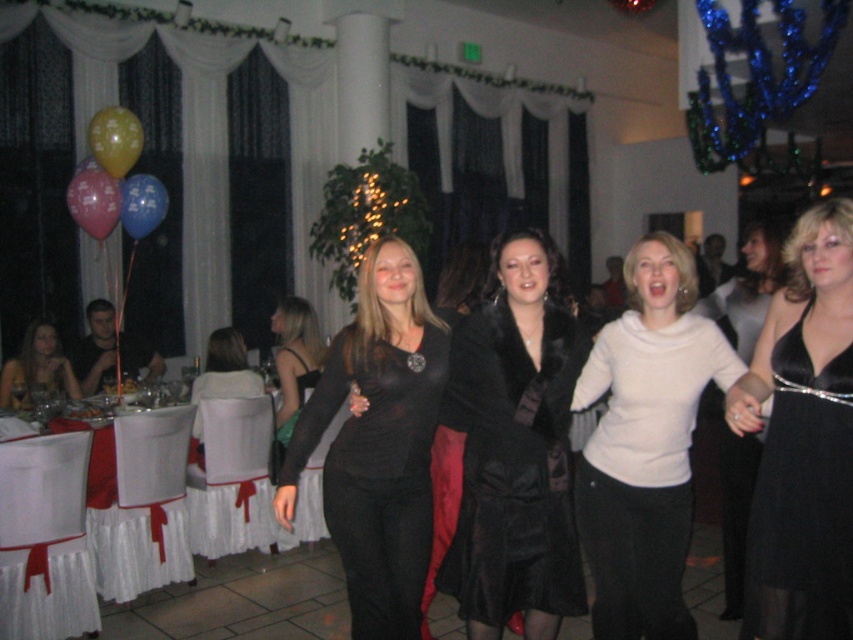
You are a photographer at the party and need to adjust the lighting to focus on the black satin dress at center. Based on its position, which area of the image should you direct the spotlight towards?

The black satin dress at center is located at point coordinates (747, 289), so you should direct the spotlight towards the area corresponding to these coordinates to focus on the black satin dress at center.

You are at the lively indoor party scene with elegant white drapery and large windows with green garlands. You see two points marked in the image. Which point is closer to you, point (740, 506) or point (136, 152)?

Point (740, 506) is closer to the viewer than point (136, 152).